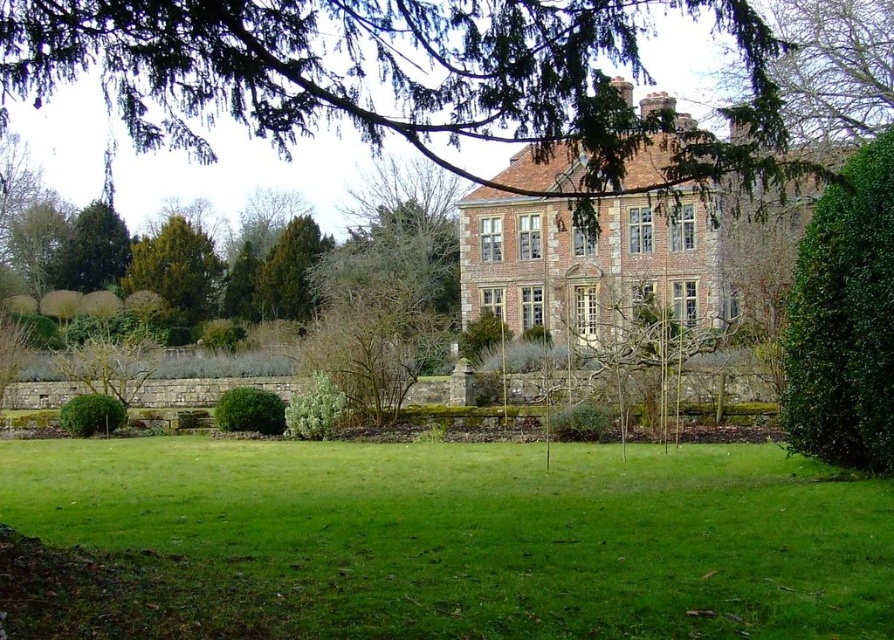
Question: Does green grass at center appear on the left side of green leafy tree at upper center?

Choices:
 (A) no
 (B) yes

Answer: (A)

Question: Does green grass at center appear under green leafy bush at lower left?

Choices:
 (A) yes
 (B) no

Answer: (A)

Question: Does green leafy tree at upper center have a larger size compared to silvery-green leafy bush at center?

Choices:
 (A) no
 (B) yes

Answer: (B)

Question: Which of the following is the farthest from the observer?

Choices:
 (A) green leafy hedge at center
 (B) green grass at center

Answer: (A)

Question: Which point is closer to the camera?

Choices:
 (A) (136, 284)
 (B) (338, 417)
 (C) (87, 410)
 (D) (224, 392)

Answer: (B)

Question: Which object is farther from the camera taking this photo?

Choices:
 (A) green leafy tree at left
 (B) green leafy bush at lower left
 (C) green grass at center
 (D) green leafy hedge at center

Answer: (A)